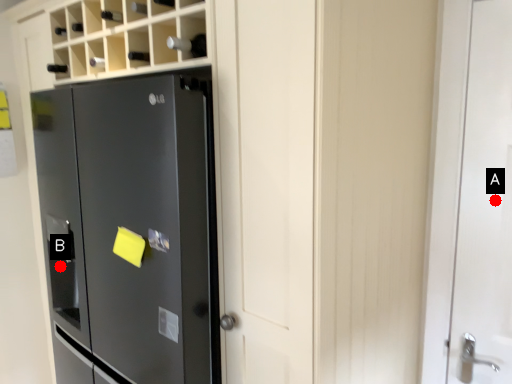
Question: Two points are circled on the image, labeled by A and B beside each circle. Which of the following is the closest to the observer?

Choices:
 (A) A is closer
 (B) B is closer

Answer: (A)